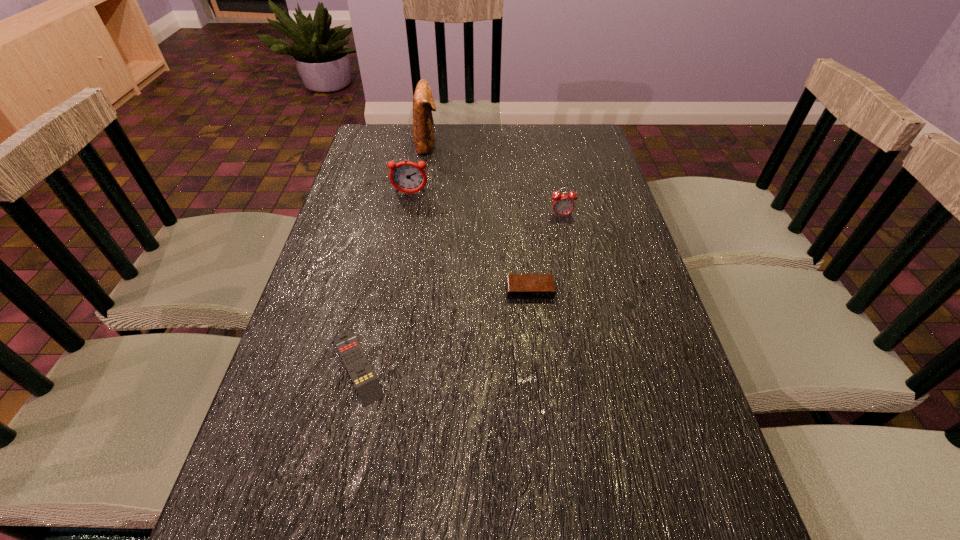
Locate an element on the screen. The width and height of the screenshot is (960, 540). vacant space situated on the front-facing side of the tallest alarm clock is located at coordinates (401, 243).

Identify the location of vacant space located on the face of the rightmost alarm clock. The image size is (960, 540). (577, 293).

You are a GUI agent. You are given a task and a screenshot of the screen. Output one action in this format:
    pyautogui.click(x=<x>, y=<y>)
    Task: Click on the free spot located 0.160m on the front face of the fourth farthest object
    This screenshot has height=540, width=960.
    Given the screenshot: What is the action you would take?
    pyautogui.click(x=537, y=357)

This screenshot has height=540, width=960. Find the location of `blank space located on the right of the remote control`. blank space located on the right of the remote control is located at coordinates (565, 367).

Find the location of a particular element. The width and height of the screenshot is (960, 540). object that is at the far edge is located at coordinates (423, 102).

Find the location of `alarm clock at the left edge`. alarm clock at the left edge is located at coordinates (408, 177).

The height and width of the screenshot is (540, 960). In order to click on remote control present at the left edge in this screenshot , I will do `click(362, 375)`.

This screenshot has width=960, height=540. I want to click on object that is at the right edge, so click(563, 204).

You are a GUI agent. You are given a task and a screenshot of the screen. Output one action in this format:
    pyautogui.click(x=<x>, y=<y>)
    Task: Click on the free point at the far edge
    
    Given the screenshot: What is the action you would take?
    pyautogui.click(x=485, y=149)

This screenshot has width=960, height=540. In the image, there is a desktop. Identify the location of vacant space at the left edge. (390, 184).